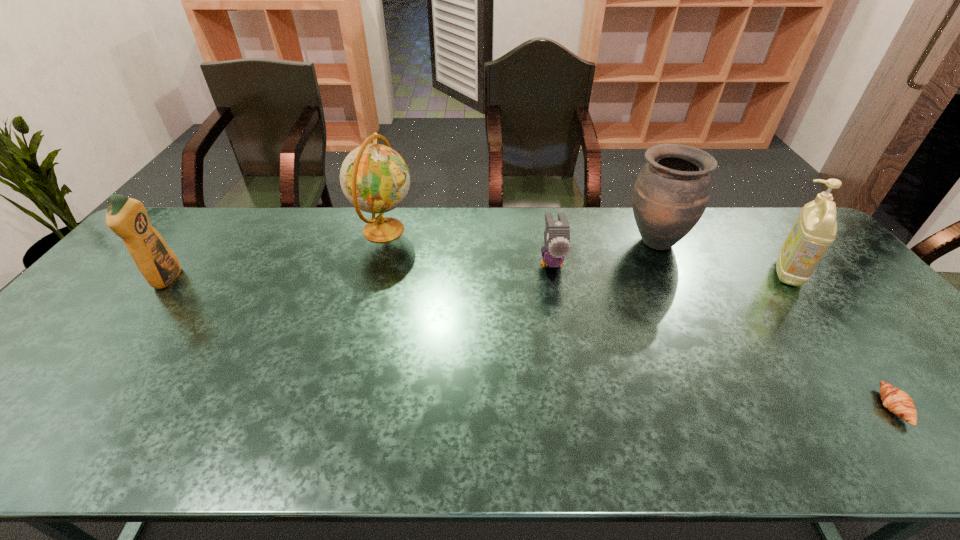
The width and height of the screenshot is (960, 540). What are the coordinates of `object that is at the left edge` in the screenshot? It's located at (126, 217).

The height and width of the screenshot is (540, 960). Identify the location of detergent at the right edge. (815, 229).

The height and width of the screenshot is (540, 960). I want to click on pastry positioned at the right edge, so click(x=897, y=401).

Image resolution: width=960 pixels, height=540 pixels. I want to click on object present at the near right corner, so click(x=897, y=401).

The height and width of the screenshot is (540, 960). I want to click on vacant region at the far edge of the desktop, so click(728, 250).

At what (x,y) coordinates should I click in order to perform the action: click on free region at the near edge of the desktop. Please return your answer as a coordinate pair (x, y). Looking at the image, I should click on point(281,439).

Image resolution: width=960 pixels, height=540 pixels. What are the coordinates of `free region at the left edge of the desktop` in the screenshot? It's located at (108, 334).

Where is `free space at the right edge`? The image size is (960, 540). free space at the right edge is located at coordinates (818, 270).

Where is `free space that is in between the second object from left to right and the left detergent`? free space that is in between the second object from left to right and the left detergent is located at coordinates point(276,254).

Identify the location of vacant space that is in between the right detergent and the left detergent. This screenshot has width=960, height=540. (477, 275).